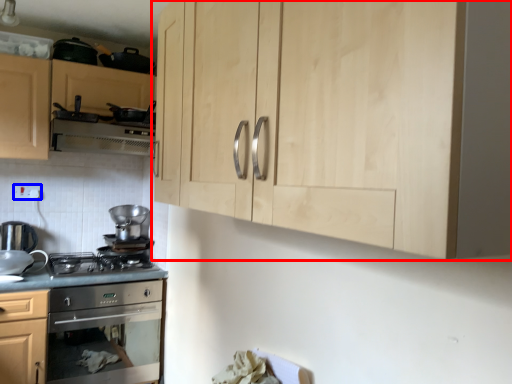
Question: Which of the following is the farthest to the observer, cabinetry (highlighted by a red box) or electric outlet (highlighted by a blue box)?

Choices:
 (A) cabinetry
 (B) electric outlet

Answer: (B)